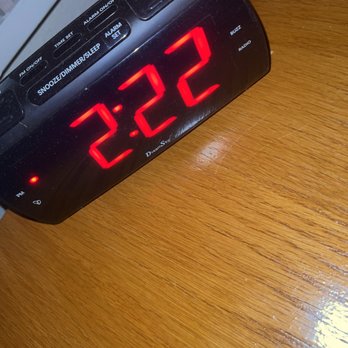
You are a GUI agent. You are given a task and a screenshot of the screen. Output one action in this format:
    pyautogui.click(x=<x>, y=<y>)
    Task: Click on the alarm set button
    The width and height of the screenshot is (348, 348).
    Given the screenshot: What is the action you would take?
    pyautogui.click(x=122, y=33)